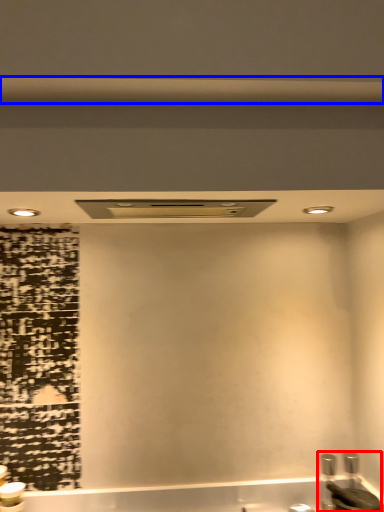
Question: Which point is further to the camera, sink (highlighted by a red box) or beam (highlighted by a blue box)?

Choices:
 (A) sink
 (B) beam

Answer: (A)